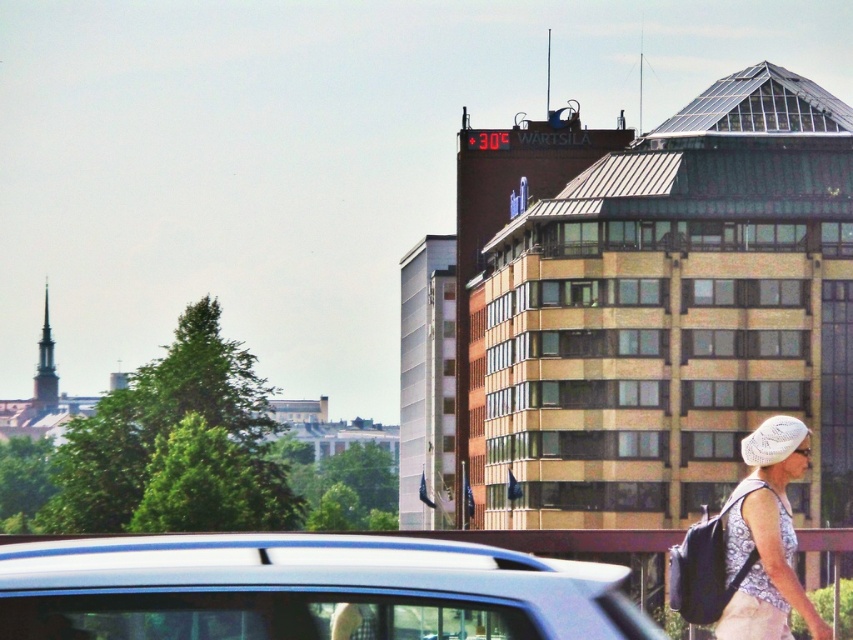
Question: Does metallic blue car at lower center lie behind white lace hat at lower right?

Choices:
 (A) yes
 (B) no

Answer: (B)

Question: Where is metallic blue car at lower center located in relation to white lace hat at lower right in the image?

Choices:
 (A) above
 (B) below

Answer: (A)

Question: Does metallic blue car at lower center appear under white lace hat at lower right?

Choices:
 (A) no
 (B) yes

Answer: (A)